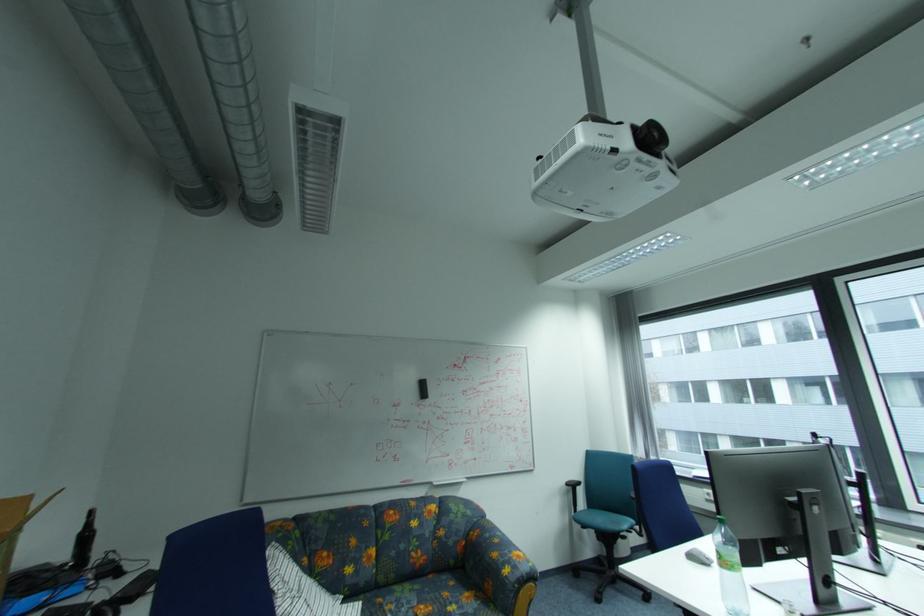
What do you see at coordinates (428, 591) in the screenshot? This screenshot has width=924, height=616. I see `the floral sofa armrest` at bounding box center [428, 591].